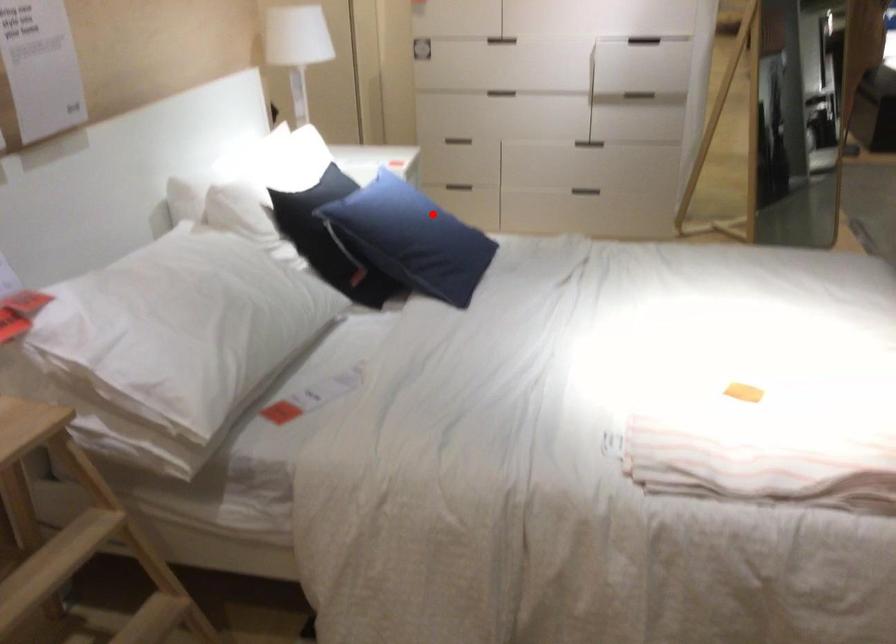
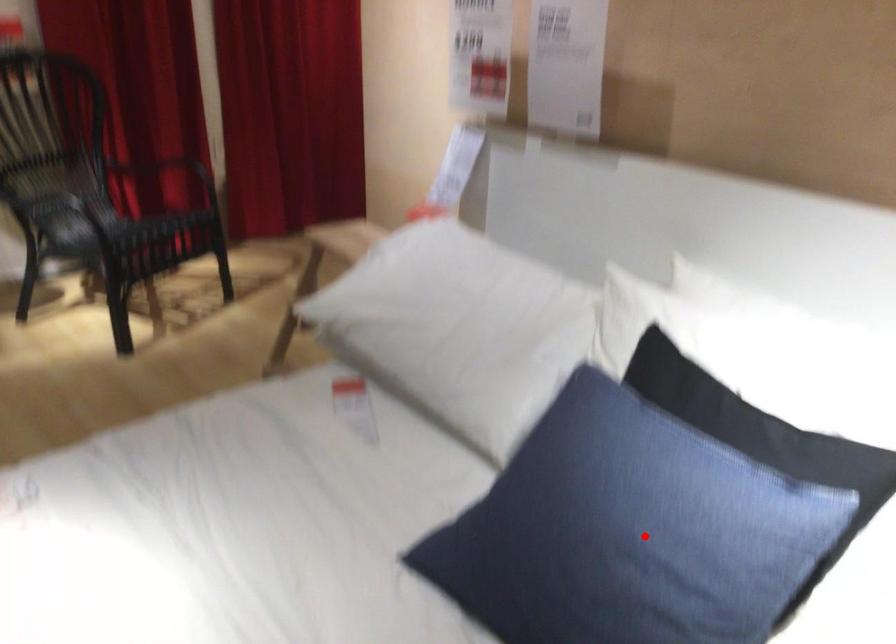
I am providing you with two images of the same scene from different viewpoints. A red point is marked on the first image and another point is marked on the second image. Do the highlighted points in image1 and image2 indicate the same real-world spot?

Yes